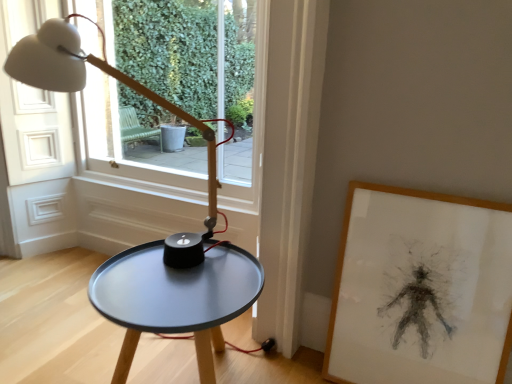
The image size is (512, 384). I want to click on vacant region to the left of matte black table at center, so click(72, 350).